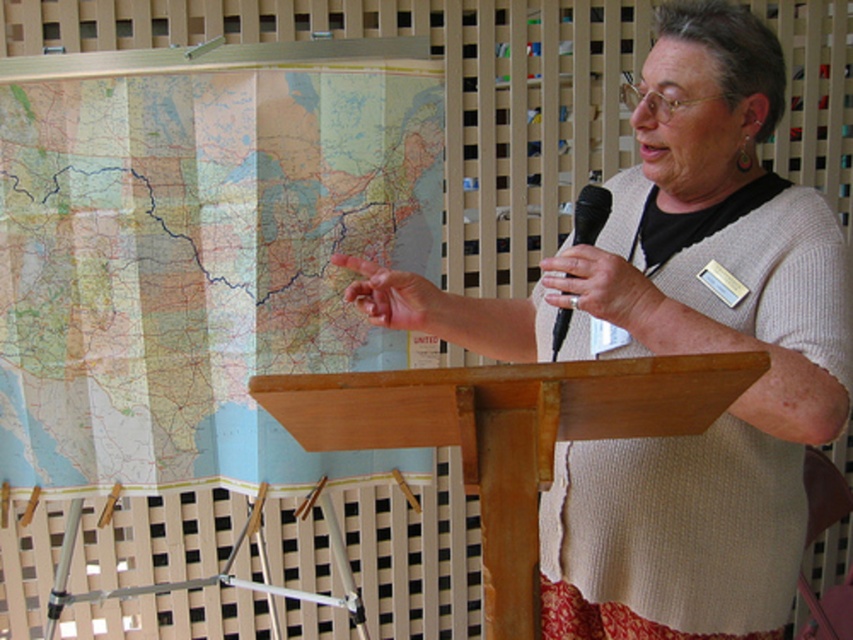
Question: Among these points, which one is farthest from the camera?

Choices:
 (A) (144, 492)
 (B) (750, 131)
 (C) (577, 198)

Answer: (A)

Question: Does paper map at left appear on the right side of black plastic microphone at upper right?

Choices:
 (A) no
 (B) yes

Answer: (A)

Question: Which object is the closest to the paper map at left?

Choices:
 (A) knitted beige sweater at center
 (B) black plastic microphone at upper right

Answer: (A)

Question: Considering the real-world distances, which object is farthest from the knitted beige sweater at center?

Choices:
 (A) black plastic microphone at upper right
 (B) paper map at left
 (C) wooden podium at center

Answer: (B)

Question: Does knitted beige sweater at center appear on the right side of wooden podium at center?

Choices:
 (A) yes
 (B) no

Answer: (A)

Question: Considering the relative positions of paper map at left and black plastic microphone at upper right in the image provided, where is paper map at left located with respect to black plastic microphone at upper right?

Choices:
 (A) below
 (B) above

Answer: (A)